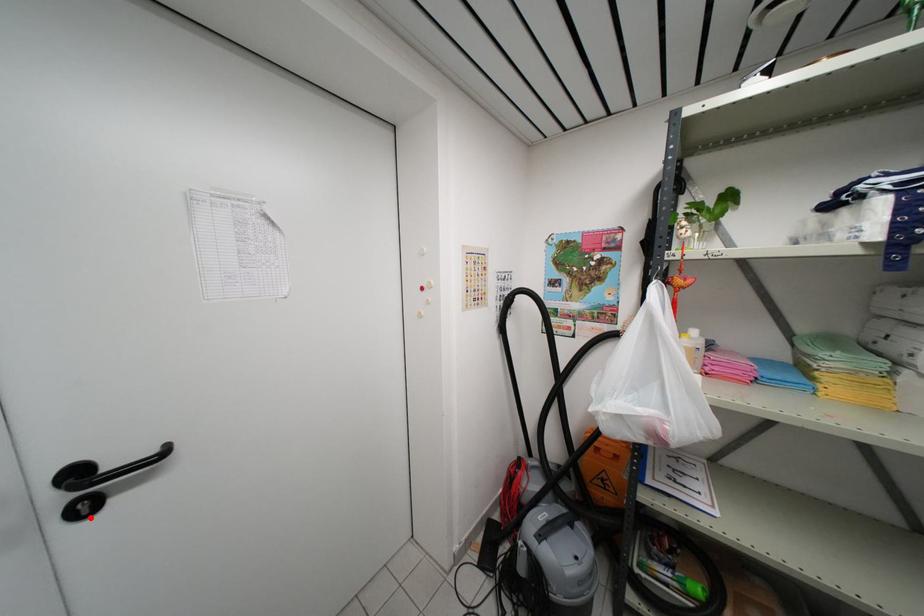
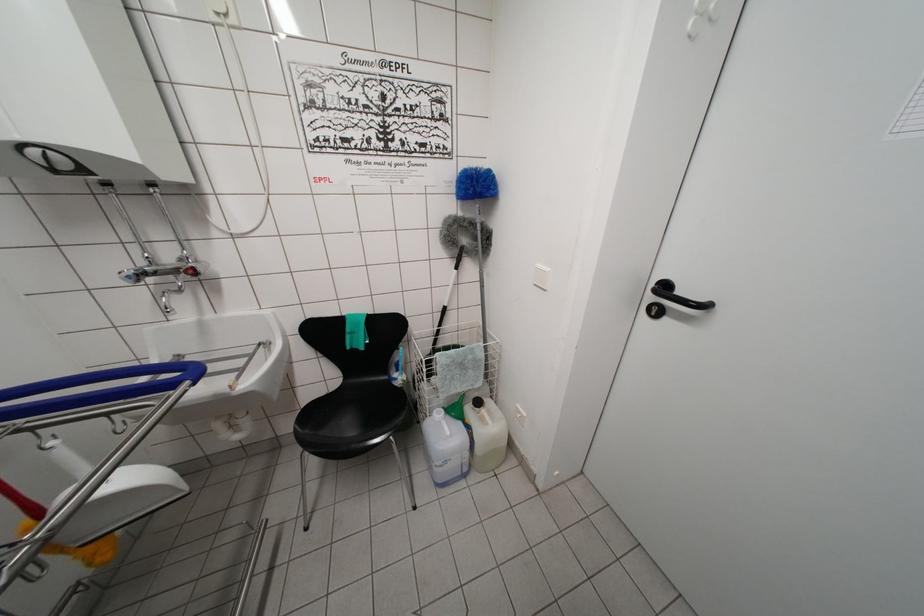
Question: I am providing you with two images of the same scene from different viewpoints. A red point is marked on the first image. At the location where the point appears in image 1, is it still visible in image 2?

Choices:
 (A) Yes
 (B) No

Answer: (A)